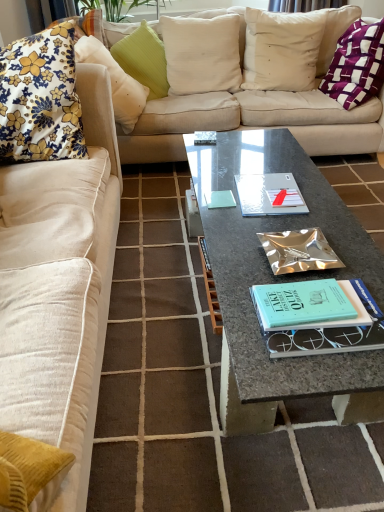
Question: From the image's perspective, is purple woven pillow at upper right, positioned as the 1th pillow in right-to-left order, positioned above or below floral fabric cushion at left, arranged as the 1th pillow when viewed from the left?

Choices:
 (A) above
 (B) below

Answer: (A)

Question: In the image, is purple woven pillow at upper right, positioned as the 1th pillow in right-to-left order, positioned in front of or behind floral fabric cushion at left, which is the sixth pillow in right-to-left order?

Choices:
 (A) behind
 (B) front

Answer: (A)

Question: Which object is the closest to the fluffy beige couch at left, which is the 2th studio couch from back to front?

Choices:
 (A) white cotton pillow at upper center, the fifth pillow in the left-to-right sequence
 (B) granite coffee table at center
 (C) purple woven pillow at upper right, positioned as the 1th pillow in right-to-left order
 (D) white linen pillow at upper center, which is the 4th pillow in left-to-right order
 (E) metallic silver book at center

Answer: (B)

Question: Estimate the real-world distances between objects in this image. Which object is farther from the beige fabric couch at upper center, which is the first studio couch from back to front?

Choices:
 (A) metallic silver book at center
 (B) granite coffee table at center
 (C) silver metallic notebook at center
 (D) fluffy beige couch at left, which is the 2th studio couch from back to front
 (E) purple woven pillow at upper right, arranged as the 6th pillow when viewed from the left

Answer: (A)